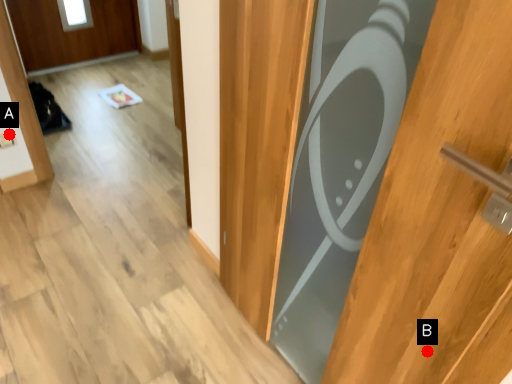
Question: Two points are circled on the image, labeled by A and B beside each circle. Which of the following is the farthest from the observer?

Choices:
 (A) A is further
 (B) B is further

Answer: (A)